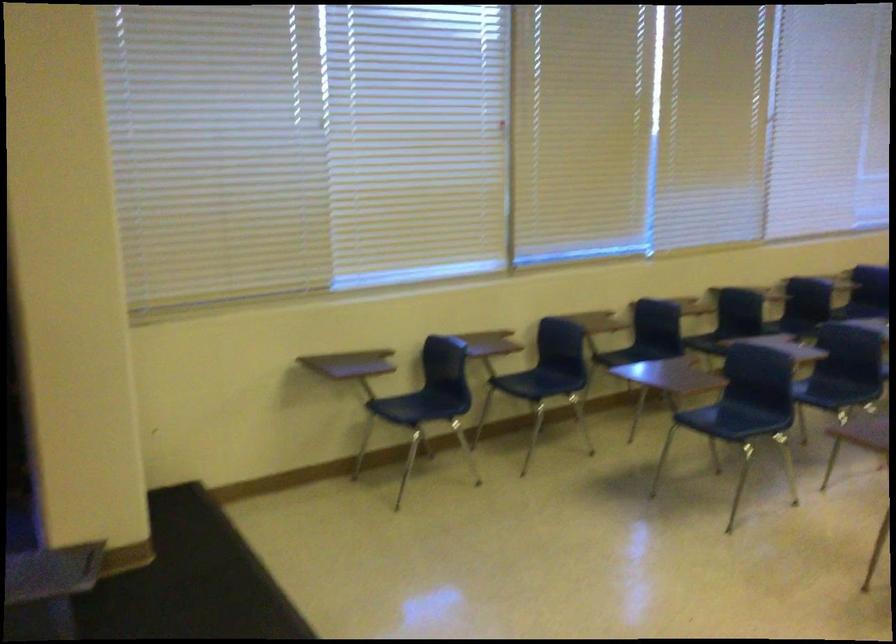
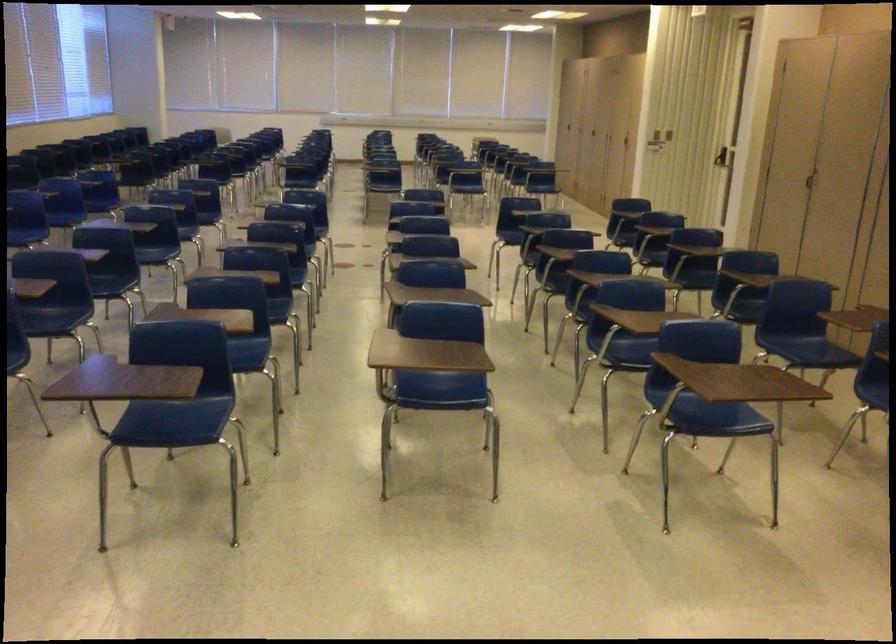
Question: Based on the continuous images, in which direction is the camera rotating? Reply with the corresponding letter.

Choices:
 (A) Left
 (B) Right
 (C) Up
 (D) Down

Answer: (B)